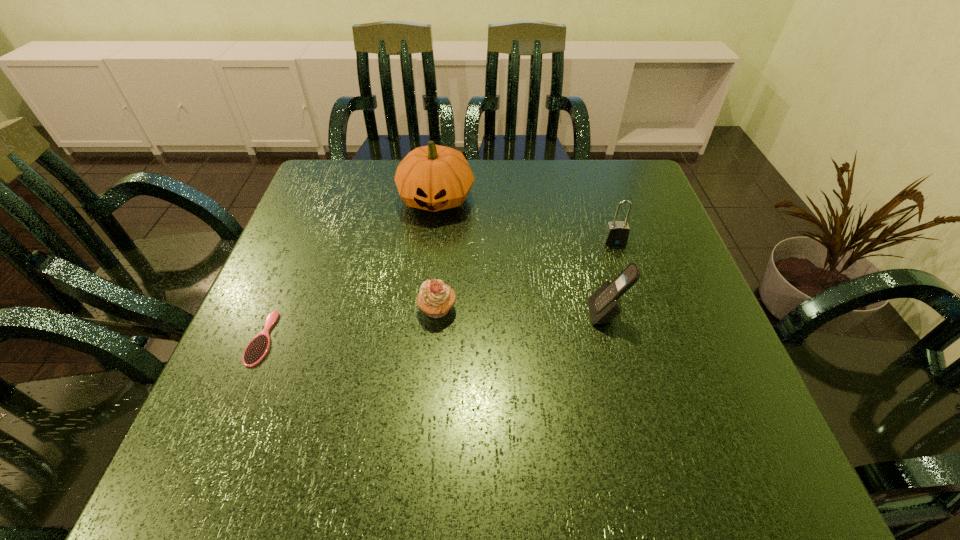
This screenshot has width=960, height=540. In the image, there is a desktop. Find the location of `vacant space at the left edge`. vacant space at the left edge is located at coordinates (324, 330).

In the image, there is a desktop. Where is `free space at the right edge`? The width and height of the screenshot is (960, 540). free space at the right edge is located at coordinates (720, 362).

The image size is (960, 540). I want to click on free space at the far right corner, so click(644, 185).

The height and width of the screenshot is (540, 960). In the image, there is a desktop. In order to click on free space at the near right corner in this screenshot , I will do `click(775, 479)`.

Identify the location of vacant area that lies between the second shortest object and the padlock. (526, 275).

You are a GUI agent. You are given a task and a screenshot of the screen. Output one action in this format:
    pyautogui.click(x=<x>, y=<y>)
    Task: Click on the free space between the fourth nearest object and the tallest object
    Image resolution: width=960 pixels, height=540 pixels.
    Given the screenshot: What is the action you would take?
    pyautogui.click(x=525, y=220)

Identify the location of empty space between the farthest object and the cellular telephone. The height and width of the screenshot is (540, 960). (521, 256).

Find the location of a particular element. The height and width of the screenshot is (540, 960). free space between the padlock and the tallest object is located at coordinates (525, 220).

At what (x,y) coordinates should I click in order to perform the action: click on free area in between the cupcake and the farthest object. Please return your answer as a coordinate pair (x, y). The height and width of the screenshot is (540, 960). Looking at the image, I should click on (437, 254).

This screenshot has width=960, height=540. I want to click on free spot between the fourth tallest object and the fourth object from left to right, so 522,312.